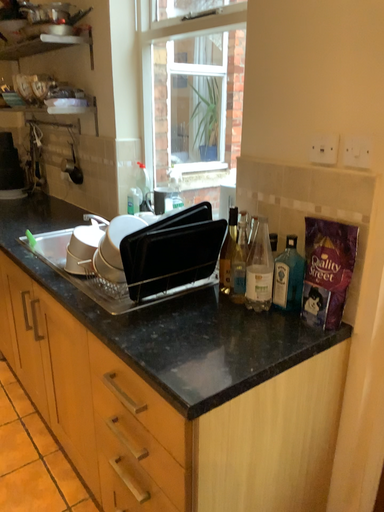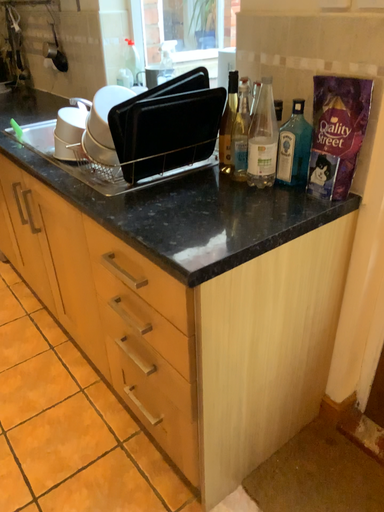
Question: How did the camera likely rotate when shooting the video?

Choices:
 (A) rotated upward
 (B) rotated downward

Answer: (B)